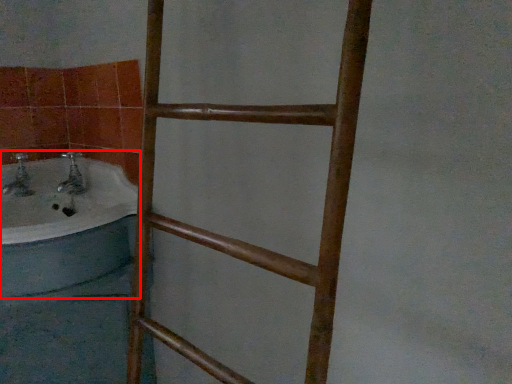
Question: From the image's perspective, what is the correct spatial relationship of bathtub (annotated by the red box) in relation to ladder?

Choices:
 (A) above
 (B) below

Answer: (A)